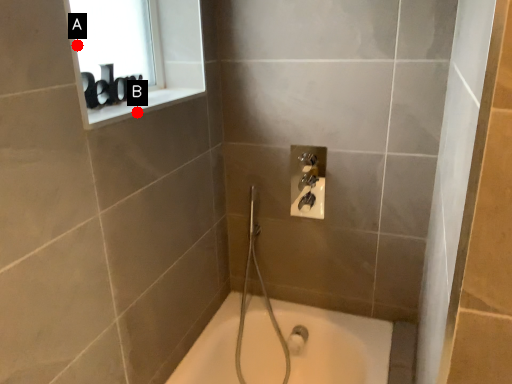
Question: Two points are circled on the image, labeled by A and B beside each circle. Which of the following is the farthest from the observer?

Choices:
 (A) A is further
 (B) B is further

Answer: (A)